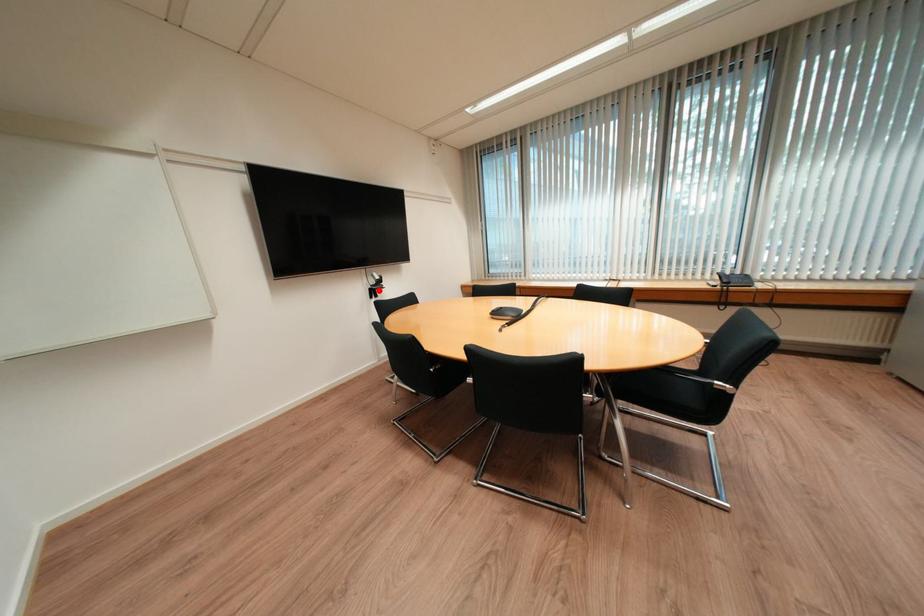
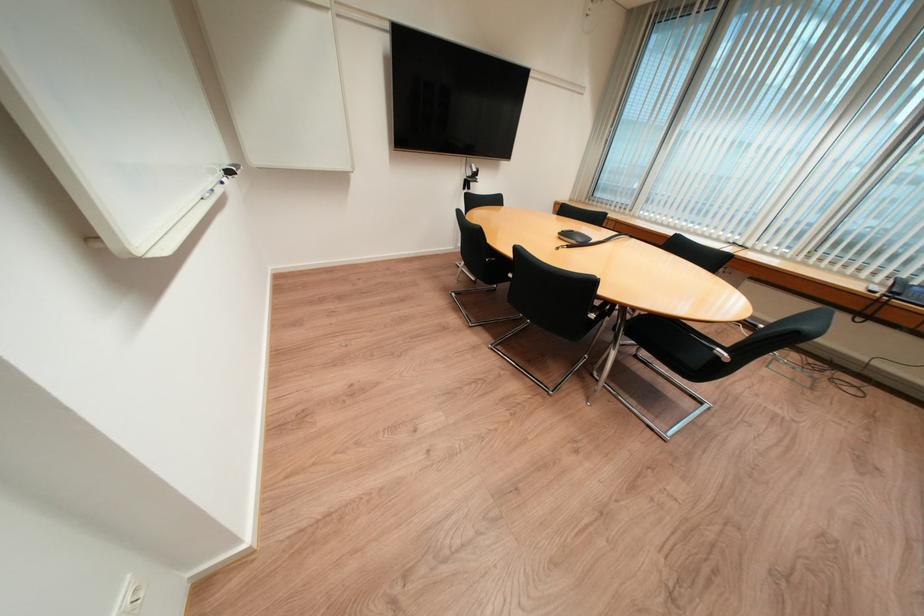
Question: I am providing you with two images of the same scene from different viewpoints. A red point is shown in image1. For the corresponding object point in image2, is it positioned nearer or farther from the camera?

Choices:
 (A) Nearer
 (B) Farther

Answer: (A)